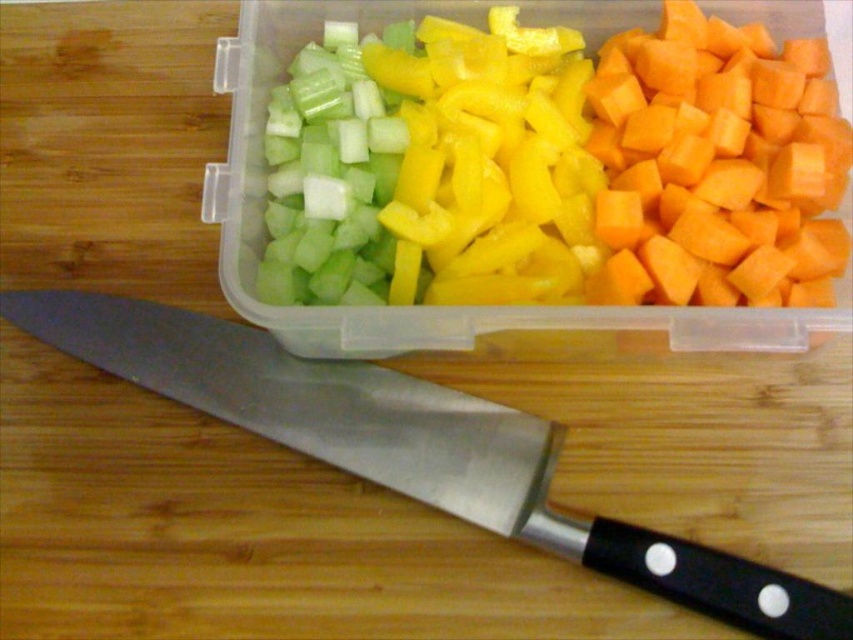
You need to determine if the polished metal knife at center can be placed on top of the green translucent celery at upper left without damaging it. Based on their sizes, is this possible?

The polished metal knife at center is larger in size than the green translucent celery at upper left, so placing the knife on top might not be feasible due to its larger size potentially causing damage or instability.

You are preparing a salad and need to add the green translucent celery at upper left to the container. The polished metal knife at center is in your way. Which direction should you move the knife to access the celery?

You should move the polished metal knife at center to the right since it is currently to the left of the green translucent celery at upper left, blocking access.